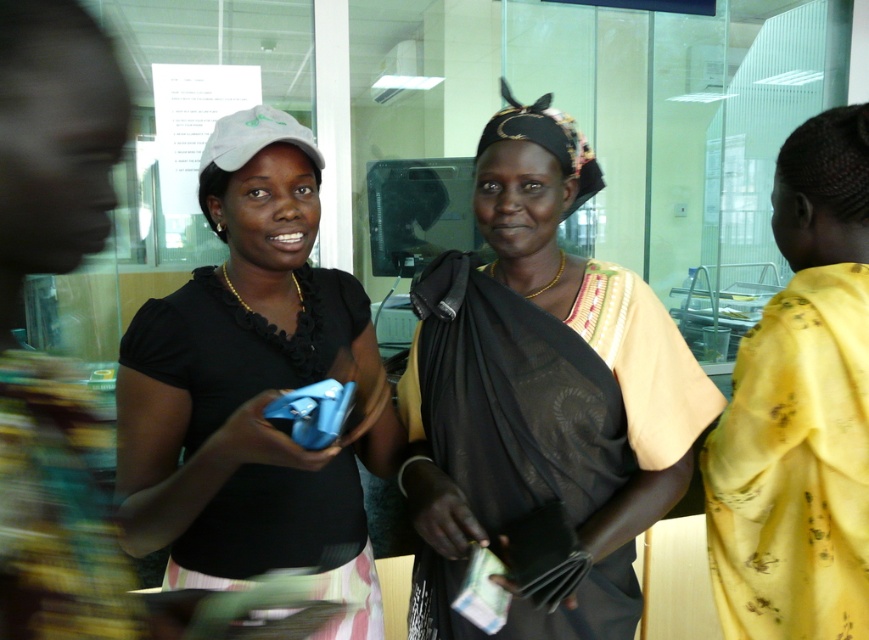
You are navigating through the public area and need to reach the point at coordinates (329, 298). There are two points marked in the scene. Which point is closer to your current position if you are standing at the point at (531, 621)?

Point (531, 621) is in front of point (329, 298), so if you are standing at point (531, 621), the closer point to your current position would be point (531, 621) itself. However, since you need to reach point (329, 298), you would have to move backward from your current position.

You are a fashion designer observing the individual in the center. Which item, the black textured scarf at center or the matte black shirt at center, has a greater width when laid flat?

The black textured scarf at center is wider than the matte black shirt at center when laid flat.